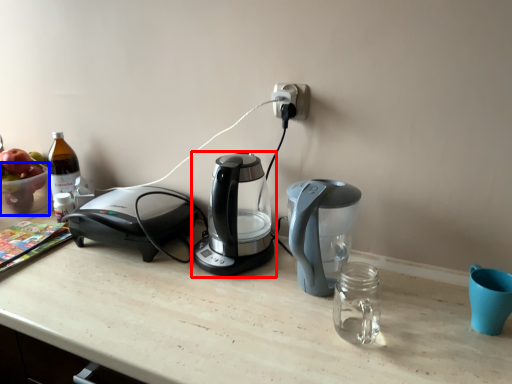
Question: Among these objects, which one is nearest to the camera, coffee maker (highlighted by a red box) or bowl (highlighted by a blue box)?

Choices:
 (A) coffee maker
 (B) bowl

Answer: (A)